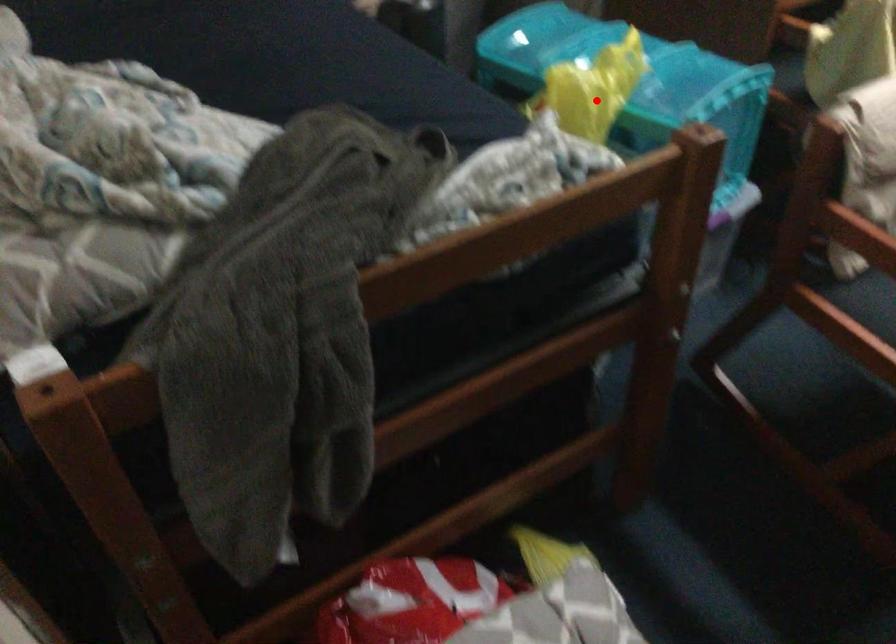
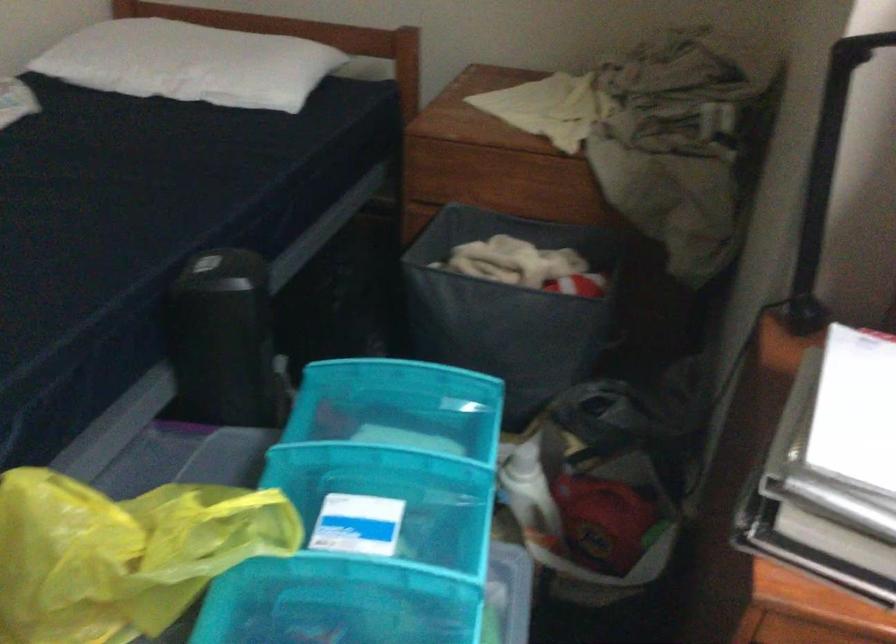
Find the pixel in the second image that matches the highlighted location in the first image.

(122, 554)